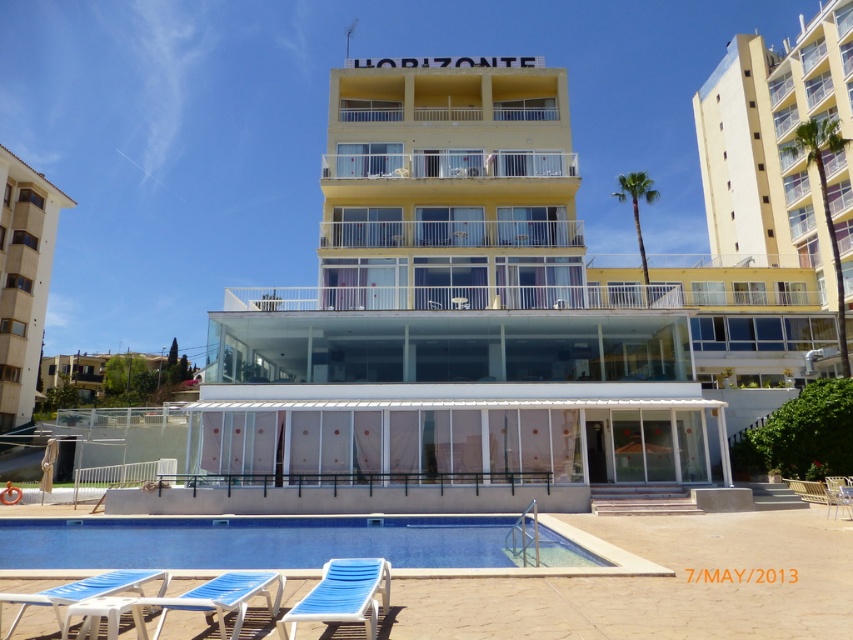
Who is more forward, (44,244) or (236,577)?

Point (236,577) is in front.

Can you confirm if beige concrete building at left is positioned above blue fabric lounge chair at lower left?

Yes, beige concrete building at left is above blue fabric lounge chair at lower left.

Between point (9, 401) and point (248, 572), which one is positioned behind?

The point (9, 401) is behind.

Where is `beige concrete building at left`? beige concrete building at left is located at coordinates (22, 280).

From the picture: Does yellow matte building at center appear under blue smooth pool at center?

No, yellow matte building at center is not below blue smooth pool at center.

Is point (407, 157) farther from viewer compared to point (465, 541)?

Yes, point (407, 157) is farther from viewer.

Is point (579, 346) more distant than point (463, 529)?

Yes, it is behind point (463, 529).

Where is `yellow matte building at center`? The height and width of the screenshot is (640, 853). yellow matte building at center is located at coordinates (453, 308).

Is point (808, 145) less distant than point (223, 593)?

No, it is not.

Describe the element at coordinates (784, 154) in the screenshot. I see `yellow matte building at upper right` at that location.

Image resolution: width=853 pixels, height=640 pixels. What are the coordinates of `yellow matte building at upper right` in the screenshot? It's located at (784, 154).